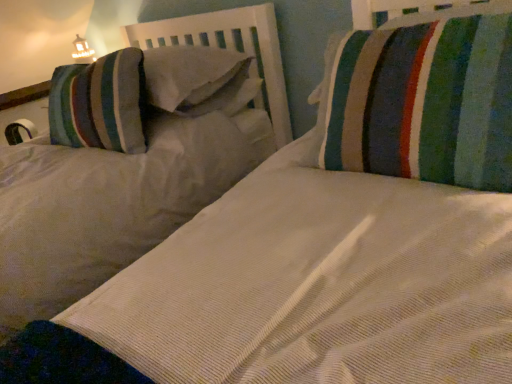
This screenshot has width=512, height=384. I want to click on striped fabric pillow at upper right, so click(x=425, y=99).

What do you see at coordinates (425, 99) in the screenshot?
I see `striped fabric pillow at upper right` at bounding box center [425, 99].

Identify the location of striped fabric pillow at upper right. (425, 99).